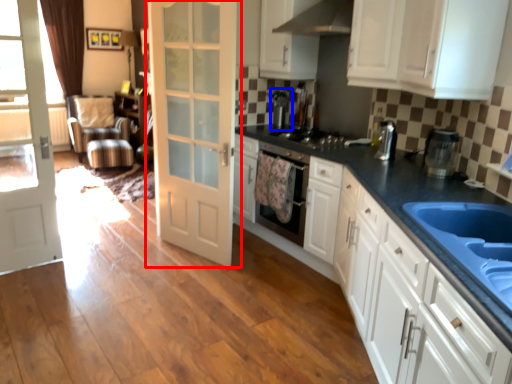
Question: Which of the following is the closest to the observer, door (highlighted by a red box) or coffee machine (highlighted by a blue box)?

Choices:
 (A) door
 (B) coffee machine

Answer: (A)